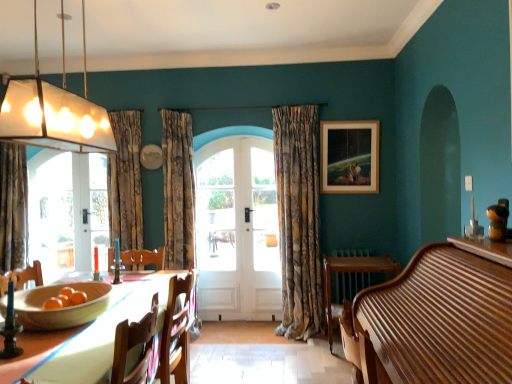
At what (x,y) coordinates should I click in order to perform the action: click on translucent glass pendant light at upper left. Please return your answer as a coordinate pair (x, y). Looking at the image, I should click on (53, 111).

Measure the distance between translucent glass pendant light at upper left and camera.

translucent glass pendant light at upper left is 1.56 meters away from camera.

The height and width of the screenshot is (384, 512). What do you see at coordinates (298, 219) in the screenshot? I see `textured beige curtain at center, which is counted as the third curtain, starting from the left` at bounding box center [298, 219].

Measure the distance between clear glass door at left and camera.

3.95 meters.

Where is `clear glass door at left`? This screenshot has width=512, height=384. clear glass door at left is located at coordinates (68, 212).

What do you see at coordinates (125, 181) in the screenshot? This screenshot has height=384, width=512. I see `textured beige curtain at center, which is the second curtain in left-to-right order` at bounding box center [125, 181].

This screenshot has height=384, width=512. What are the coordinates of `white wood screen door at center` in the screenshot? It's located at (265, 234).

Measure the distance between white wood screen door at center and camera.

The depth of white wood screen door at center is 13.97 feet.

Describe the element at coordinates (237, 230) in the screenshot. The image size is (512, 384). I see `white wooden door at center` at that location.

Where is `translucent glass pendant light at upper left`? This screenshot has width=512, height=384. translucent glass pendant light at upper left is located at coordinates (53, 111).

Does clear glass door at left have a larger size compared to wooden piano at right?

No, clear glass door at left is not bigger than wooden piano at right.

Is clear glass door at left completely or partially outside of wooden piano at right?

Absolutely, clear glass door at left is external to wooden piano at right.

Does point (64, 171) appear closer or farther from the camera than point (494, 295)?

Point (64, 171).

From the image's perspective, is clear glass door at left positioned above or below wooden piano at right?

Based on their image positions, clear glass door at left is located above wooden piano at right.

Is point (487, 376) farther from camera compared to point (346, 143)?

No, it is in front of (346, 143).

From the image's perspective, which one is positioned higher, wooden piano at right or wooden picture frame at upper right?

wooden picture frame at upper right is shown above in the image.

How different are the orientations of wooden piano at right and wooden picture frame at upper right in degrees?

The angle between the facing direction of wooden piano at right and the facing direction of wooden picture frame at upper right is 90.5 degrees.

Based on their sizes in the image, would you say wooden piano at right is bigger or smaller than wooden picture frame at upper right?

Clearly, wooden piano at right is larger in size than wooden picture frame at upper right.

Considering the sizes of objects textured beige curtain at center, the 2th curtain in the right-to-left sequence, and white wooden door at center in the image provided, who is thinner, textured beige curtain at center, the 2th curtain in the right-to-left sequence, or white wooden door at center?

Thinner between the two is white wooden door at center.

Would you say white wooden door at center is part of textured beige curtain at center, which is the second curtain in left-to-right order,'s contents?

No, white wooden door at center is located outside of textured beige curtain at center, which is the second curtain in left-to-right order.

Is textured beige curtain at center, which is the second curtain in left-to-right order, in front of white wooden door at center?

Yes, textured beige curtain at center, which is the second curtain in left-to-right order, is in front of white wooden door at center.

Is the surface of textured beige curtain at center, the 2th curtain in the right-to-left sequence, in direct contact with white wooden door at center?

There is a gap between textured beige curtain at center, the 2th curtain in the right-to-left sequence, and white wooden door at center.

How distant is white wooden door at center from wooden picture frame at upper right?

white wooden door at center and wooden picture frame at upper right are 37.89 inches apart from each other.

Find the location of a particular element. Image resolution: width=512 pixels, height=384 pixels. picture frame above the white wooden door at center (from a real-world perspective) is located at coordinates (349, 156).

What's the angular difference between white wooden door at center and wooden picture frame at upper right's facing directions?

white wooden door at center and wooden picture frame at upper right are facing 0.742 degrees away from each other.

From the picture: Does white wooden door at center contain wooden picture frame at upper right?

That's incorrect, wooden picture frame at upper right is not inside white wooden door at center.

Measure the distance from textured beige curtain at center, the 2th curtain in the right-to-left sequence, to translucent glass pendant light at upper left.

textured beige curtain at center, the 2th curtain in the right-to-left sequence, and translucent glass pendant light at upper left are 1.90 meters apart from each other.

Consider the image. Is textured beige curtain at center, which is the second curtain in left-to-right order, to the right of translucent glass pendant light at upper left from the viewer's perspective?

No, textured beige curtain at center, which is the second curtain in left-to-right order, is not to the right of translucent glass pendant light at upper left.

Between textured beige curtain at center, the 2th curtain in the right-to-left sequence, and translucent glass pendant light at upper left, which one has larger size?

translucent glass pendant light at upper left is bigger.

From a real-world perspective, is textured beige curtain at center, which is the second curtain in left-to-right order, over translucent glass pendant light at upper left?

No, from a real-world perspective, textured beige curtain at center, which is the second curtain in left-to-right order, is not on top of translucent glass pendant light at upper left.

Considering the relative positions of patterned fabric curtain at left, which is the first curtain from left to right, and wooden piano at right in the image provided, is patterned fabric curtain at left, which is the first curtain from left to right, to the left of wooden piano at right from the viewer's perspective?

Correct, you'll find patterned fabric curtain at left, which is the first curtain from left to right, to the left of wooden piano at right.

Is wooden piano at right inside patterned fabric curtain at left, the third curtain positioned from the right?

No, wooden piano at right is not surrounded by patterned fabric curtain at left, the third curtain positioned from the right.

Is patterned fabric curtain at left, the third curtain positioned from the right, aimed at wooden piano at right?

No, patterned fabric curtain at left, the third curtain positioned from the right, is not aimed at wooden piano at right.

Who is more distant, patterned fabric curtain at left, the third curtain positioned from the right, or wooden piano at right?

Positioned behind is patterned fabric curtain at left, the third curtain positioned from the right.

How different are the orientations of translucent glass pendant light at upper left and wooden piano at right in degrees?

The angle between the facing direction of translucent glass pendant light at upper left and the facing direction of wooden piano at right is 178 degrees.

Does translucent glass pendant light at upper left have a greater height compared to wooden piano at right?

Yes, translucent glass pendant light at upper left is taller than wooden piano at right.

Between translucent glass pendant light at upper left and wooden piano at right, which one has larger size?

wooden piano at right.

At what (x,y) coordinates should I click in order to perform the action: click on dresser located below the clear glass door at left (from the image's perspective). Please return your answer as a coordinate pair (x, y). Looking at the image, I should click on (439, 320).

I want to click on dresser below the wooden picture frame at upper right (from a real-world perspective), so coord(439,320).

Estimate the real-world distances between objects in this image. Which object is closer to white wooden door at center, wooden bowl at lower left or wooden table at lower left?

wooden table at lower left.

From the image, which object appears to be farther from patterned fabric curtain at left, the third curtain positioned from the right, white wooden door at center or translucent glass pendant light at upper left?

translucent glass pendant light at upper left is positioned further to the anchor patterned fabric curtain at left, the third curtain positioned from the right.

From the image, which object appears to be nearer to wooden table at lower left, white wood screen door at center or white wooden door at center?

white wooden door at center is closer to wooden table at lower left.

When comparing their distances from translucent glass pendant light at upper left, does wooden piano at right or textured beige curtain at center, which is the second curtain in left-to-right order, seem closer?

wooden piano at right is positioned closer to the anchor translucent glass pendant light at upper left.

Based on their spatial positions, is wooden table at lower left or textured beige curtain at center, which is the second curtain in left-to-right order, further from patterned fabric curtain at left, the third curtain positioned from the right?

The object further to patterned fabric curtain at left, the third curtain positioned from the right, is wooden table at lower left.

Estimate the real-world distances between objects in this image. Which object is closer to white wood screen door at center, textured beige curtain at center, which is counted as the first curtain, starting from the right, or textured beige curtain at center, which is the second curtain in left-to-right order?

The object closer to white wood screen door at center is textured beige curtain at center, which is counted as the first curtain, starting from the right.

Looking at the image, which one is located further to textured beige curtain at center, which is counted as the third curtain, starting from the left, clear glass door at left or translucent glass pendant light at upper left?

clear glass door at left is positioned further to the anchor textured beige curtain at center, which is counted as the third curtain, starting from the left.

When comparing their distances from translucent glass pendant light at upper left, does patterned fabric curtain at left, the third curtain positioned from the right, or wooden table at lower left seem closer?

Among the two, wooden table at lower left is located nearer to translucent glass pendant light at upper left.

Identify the location of round table located between wooden bowl at lower left and wooden picture frame at upper right in the depth direction. This screenshot has width=512, height=384. (350, 274).

Where is `door situated between white wooden door at center and wooden round table at lower right from left to right`? door situated between white wooden door at center and wooden round table at lower right from left to right is located at coordinates (237, 230).

The image size is (512, 384). I want to click on curtain located between patterned fabric curtain at left, which is the first curtain from left to right, and white wooden door at center in the left-right direction, so click(125, 181).

Where is `window screen between wooden piano at right and clear glass door at left from front to back`? The width and height of the screenshot is (512, 384). window screen between wooden piano at right and clear glass door at left from front to back is located at coordinates (216, 213).